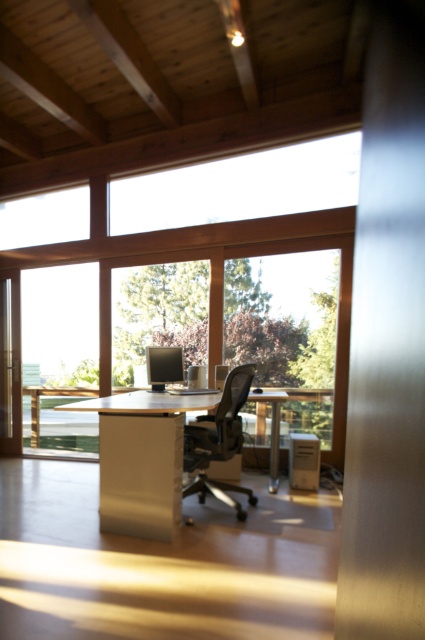
Question: From the image, what is the correct spatial relationship of clear glass window at center in relation to white glossy computer desk at center?

Choices:
 (A) left
 (B) right

Answer: (A)

Question: Is clear glass window at center further to the viewer compared to matte black office chair at center?

Choices:
 (A) yes
 (B) no

Answer: (A)

Question: Does white glossy computer desk at center appear on the right side of matte black office chair at center?

Choices:
 (A) yes
 (B) no

Answer: (B)

Question: Based on their relative distances, which object is farther from the clear glass window at center?

Choices:
 (A) white glossy computer desk at center
 (B) matte black office chair at center

Answer: (A)

Question: Which object is the closest to the white glossy computer desk at center?

Choices:
 (A) clear glass window at center
 (B) matte black office chair at center

Answer: (B)

Question: Which object appears closest to the camera in this image?

Choices:
 (A) white glossy computer desk at center
 (B) clear glass window at center

Answer: (A)